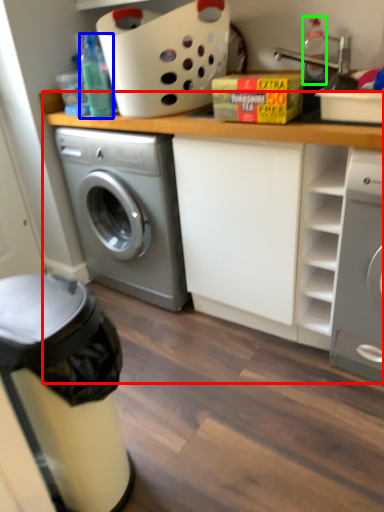
Question: Considering the real-world distances, which object is closest to counter top (highlighted by a red box)? bottle (highlighted by a blue box) or bottle (highlighted by a green box).

Choices:
 (A) bottle
 (B) bottle

Answer: (A)